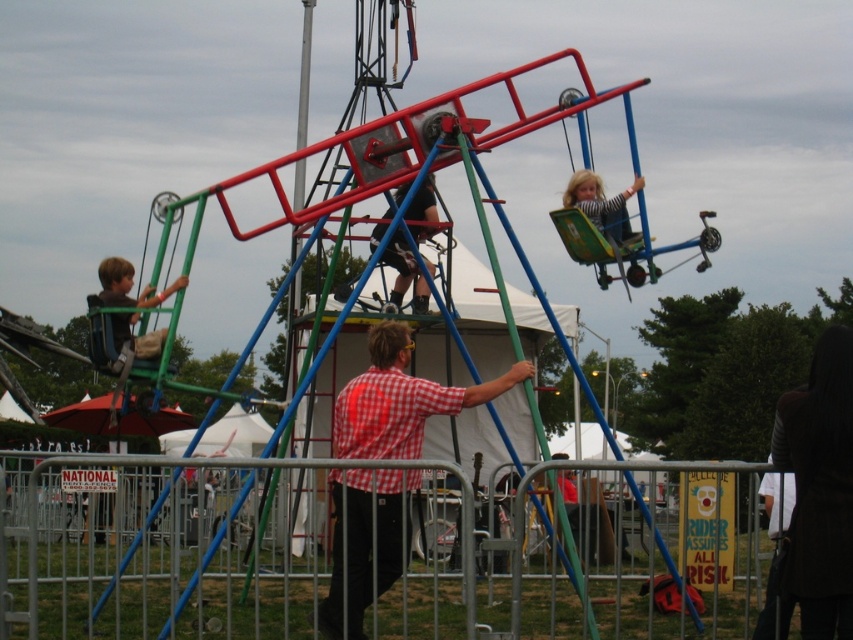
Is the position of red checkered shirt at center more distant than that of matte green swing at left?

No, red checkered shirt at center is closer to the viewer.

Who is more distant from viewer, (x=387, y=376) or (x=158, y=300)?

Point (x=158, y=300)

Where is `red checkered shirt at center`? This screenshot has height=640, width=853. red checkered shirt at center is located at coordinates (399, 400).

Is red checkered shirt at center positioned at the back of striped fabric child at upper center?

No, red checkered shirt at center is closer to the viewer.

Who is positioned more to the right, red checkered shirt at center or striped fabric child at upper center?

From the viewer's perspective, striped fabric child at upper center appears more on the right side.

Describe the element at coordinates (399, 400) in the screenshot. This screenshot has height=640, width=853. I see `red checkered shirt at center` at that location.

The image size is (853, 640). I want to click on red checkered shirt at center, so [x=399, y=400].

Does red checkered shirt at center appear under matte black pants at center?

Correct, red checkered shirt at center is located below matte black pants at center.

Is red checkered shirt at center wider than matte black pants at center?

Yes, red checkered shirt at center is wider than matte black pants at center.

Find the location of a particular element. The height and width of the screenshot is (640, 853). red checkered shirt at center is located at coordinates (399, 400).